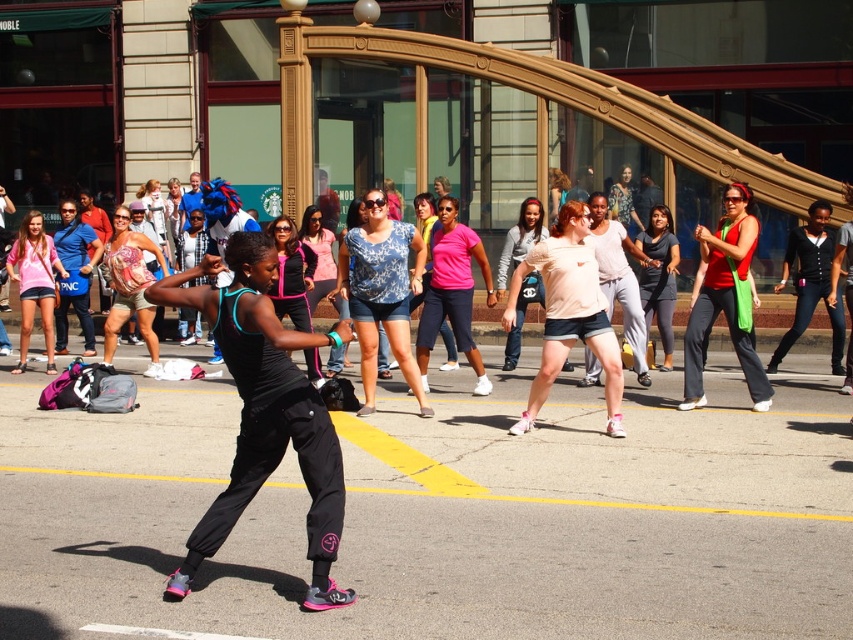
Can you confirm if black matte athletic pants at center is shorter than matte pink shirt at left?

Indeed, black matte athletic pants at center has a lesser height compared to matte pink shirt at left.

Does black matte athletic pants at center have a greater height compared to matte pink shirt at left?

No.

Between point (264, 401) and point (45, 292), which one is positioned behind?

Positioned behind is point (45, 292).

Where is `black matte athletic pants at center`? black matte athletic pants at center is located at coordinates (265, 412).

Is blue printed blouse at center thinner than pink track pants at center?

No.

Is point (399, 284) closer to camera compared to point (287, 275)?

Yes, point (399, 284) is in front of point (287, 275).

Image resolution: width=853 pixels, height=640 pixels. What do you see at coordinates (381, 291) in the screenshot?
I see `blue printed blouse at center` at bounding box center [381, 291].

At what (x,y) coordinates should I click in order to perform the action: click on blue printed blouse at center. Please return your answer as a coordinate pair (x, y). Image resolution: width=853 pixels, height=640 pixels. Looking at the image, I should click on (381, 291).

Who is lower down, pink fabric shorts at center or matte pink shirt at left?

pink fabric shorts at center

Locate an element on the screen. The width and height of the screenshot is (853, 640). pink fabric shorts at center is located at coordinates (567, 312).

Describe the element at coordinates (567, 312) in the screenshot. I see `pink fabric shorts at center` at that location.

This screenshot has width=853, height=640. I want to click on pink fabric shorts at center, so click(567, 312).